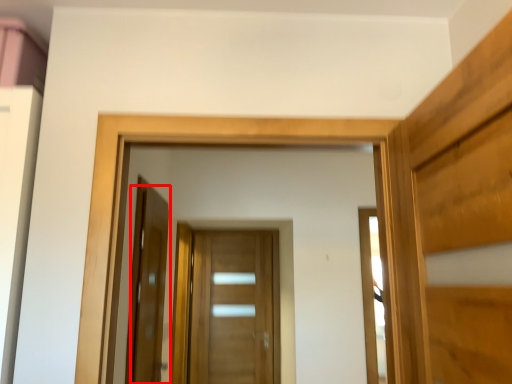
Question: In this image, where is door (annotated by the red box) located relative to door?

Choices:
 (A) left
 (B) right

Answer: (A)